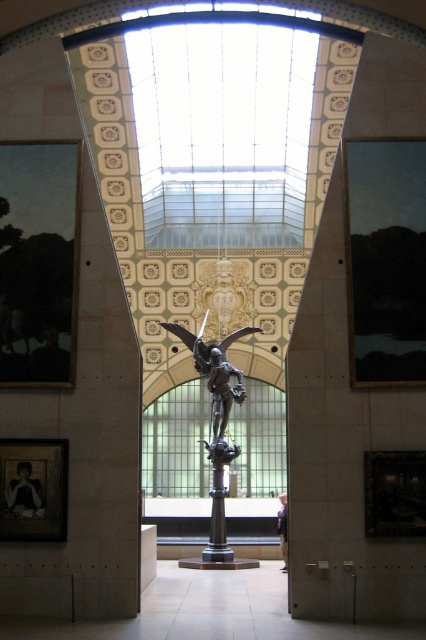
How distant is dark matte painting at right from bronze statue at center?

They are 27.76 meters apart.

Is point (351, 212) positioned before point (221, 356)?

That is True.

Is point (405, 356) positioned before point (242, 330)?

That is True.

Where is `dark matte painting at right`? dark matte painting at right is located at coordinates (385, 259).

Between point (365, 264) and point (11, 502), which one is positioned in front?

Point (11, 502) is in front.

From the picture: Can you confirm if dark matte painting at right is wider than matte black picture frame at lower left?

Correct, the width of dark matte painting at right exceeds that of matte black picture frame at lower left.

The height and width of the screenshot is (640, 426). What do you see at coordinates (385, 259) in the screenshot? I see `dark matte painting at right` at bounding box center [385, 259].

Identify the location of dark matte painting at right. tap(385, 259).

Does dark matte painting at right have a greater height compared to wooden picture frame at lower right?

Yes.

Can you confirm if dark matte painting at right is wider than wooden picture frame at lower right?

Correct, the width of dark matte painting at right exceeds that of wooden picture frame at lower right.

Is point (359, 355) closer to camera compared to point (408, 500)?

That is False.

Image resolution: width=426 pixels, height=640 pixels. What are the coordinates of `dark matte painting at right` in the screenshot? It's located at (385, 259).